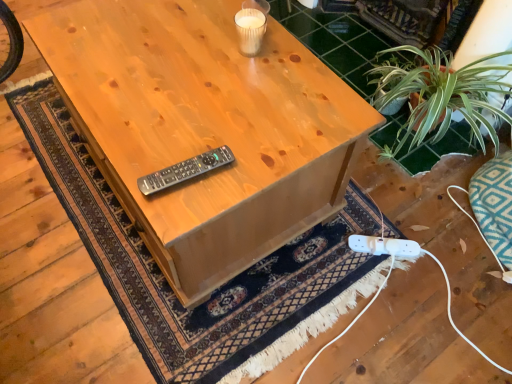
Identify the location of free space behind white plastic plug at lower right. (370, 215).